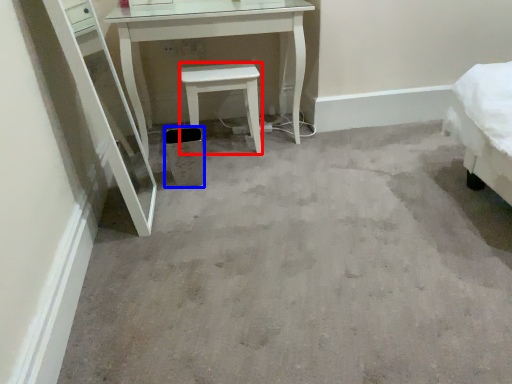
Question: Which point is further to the camera, stool (highlighted by a red box) or trash bin/can (highlighted by a blue box)?

Choices:
 (A) stool
 (B) trash bin/can

Answer: (A)